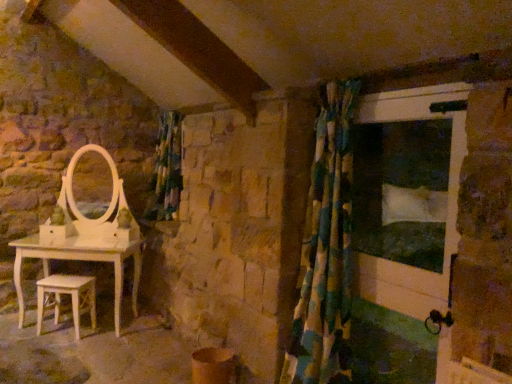
Question: Is multicolored fabric shower curtain at right shorter than white wooden stool at lower left?

Choices:
 (A) no
 (B) yes

Answer: (A)

Question: Is multicolored fabric shower curtain at right smaller than white wooden stool at lower left?

Choices:
 (A) yes
 (B) no

Answer: (B)

Question: Does multicolored fabric shower curtain at right have a greater width compared to white wooden stool at lower left?

Choices:
 (A) yes
 (B) no

Answer: (A)

Question: Are multicolored fabric shower curtain at right and white wooden stool at lower left making contact?

Choices:
 (A) yes
 (B) no

Answer: (B)

Question: Is multicolored fabric shower curtain at right bigger than white wooden stool at lower left?

Choices:
 (A) no
 (B) yes

Answer: (B)

Question: Is white wooden stool at lower left taller or shorter than multicolored fabric shower curtain at right?

Choices:
 (A) short
 (B) tall

Answer: (A)

Question: Based on their sizes in the image, would you say white wooden stool at lower left is bigger or smaller than multicolored fabric shower curtain at right?

Choices:
 (A) small
 (B) big

Answer: (A)

Question: Does point (93, 286) appear closer or farther from the camera than point (349, 203)?

Choices:
 (A) closer
 (B) farther

Answer: (B)

Question: In terms of width, does white wooden stool at lower left look wider or thinner when compared to multicolored fabric shower curtain at right?

Choices:
 (A) thin
 (B) wide

Answer: (A)

Question: From a real-world perspective, relative to white painted wood screen door at right, is green fabric curtain at center vertically above or below?

Choices:
 (A) below
 (B) above

Answer: (B)

Question: In terms of width, does green fabric curtain at center look wider or thinner when compared to white painted wood screen door at right?

Choices:
 (A) wide
 (B) thin

Answer: (A)

Question: In the image, is green fabric curtain at center on the left side or the right side of white painted wood screen door at right?

Choices:
 (A) left
 (B) right

Answer: (A)

Question: Is green fabric curtain at center inside or outside of white painted wood screen door at right?

Choices:
 (A) inside
 (B) outside

Answer: (B)

Question: From a real-world perspective, is white painted wood screen door at right positioned above or below multicolored fabric shower curtain at right?

Choices:
 (A) below
 (B) above

Answer: (B)

Question: In terms of height, does white painted wood screen door at right look taller or shorter compared to multicolored fabric shower curtain at right?

Choices:
 (A) short
 (B) tall

Answer: (A)